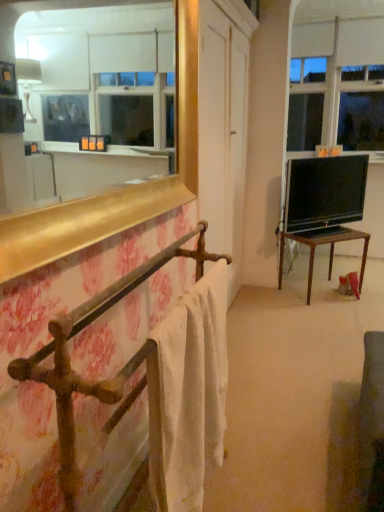
I want to click on vacant space situated on the left part of wooden table at right, so click(x=270, y=301).